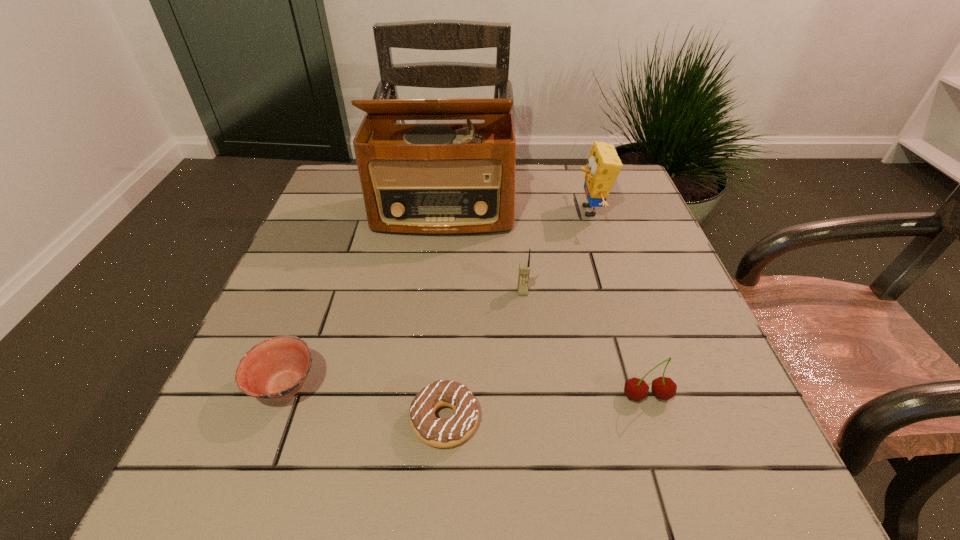
Locate an element on the screen. The width and height of the screenshot is (960, 540). vacant point located 0.230m on the face of the sponge is located at coordinates (488, 211).

The image size is (960, 540). I want to click on free spot located 0.170m on the front of the third farthest object, where the keypad is located, so click(x=530, y=361).

In order to click on vacant region located 0.060m on the surface of the cherry in this screenshot , I will do `click(660, 440)`.

The image size is (960, 540). What are the coordinates of `free location located on the right of the fifth tallest object` in the screenshot? It's located at (388, 386).

Find the location of `free space located on the right of the shortest object`. free space located on the right of the shortest object is located at coordinates (629, 420).

Identify the location of radio receiver that is at the far edge. (439, 179).

Locate an element on the screen. The width and height of the screenshot is (960, 540). sponge that is positioned at the far edge is located at coordinates (604, 165).

You are a GUI agent. You are given a task and a screenshot of the screen. Output one action in this format:
    pyautogui.click(x=<x>, y=<y>)
    Task: Click on the object positioned at the near edge
    
    Given the screenshot: What is the action you would take?
    pyautogui.click(x=442, y=433)

You are a GUI agent. You are given a task and a screenshot of the screen. Output one action in this format:
    pyautogui.click(x=<x>, y=<y>)
    Task: Click on the object situated at the left edge
    The width and height of the screenshot is (960, 540).
    Given the screenshot: What is the action you would take?
    pyautogui.click(x=276, y=369)

Where is `sponge located in the right edge section of the desktop`? sponge located in the right edge section of the desktop is located at coordinates (604, 165).